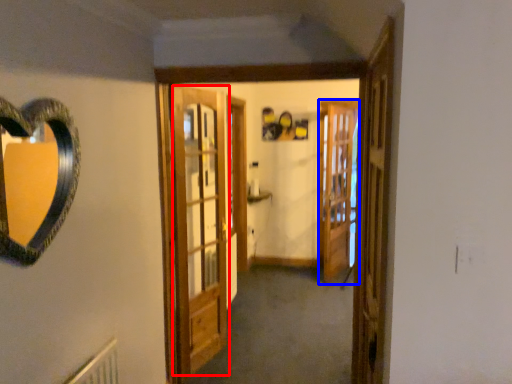
Question: Which of the following is the farthest to the observer, barn door (highlighted by a red box) or screen door (highlighted by a blue box)?

Choices:
 (A) barn door
 (B) screen door

Answer: (B)